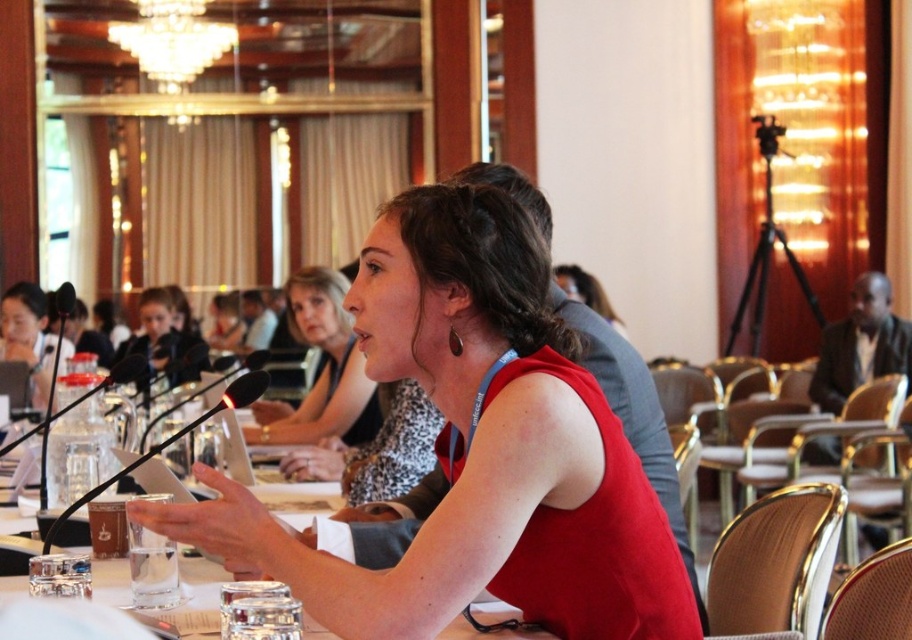
Question: Which object is the closest to the matte black microphone at upper left?

Choices:
 (A) matte red dress at center
 (B) red satin dress at center

Answer: (B)

Question: Which object is closer to the camera taking this photo?

Choices:
 (A) matte black microphone at upper left
 (B) red satin dress at center
 (C) matte red dress at center

Answer: (C)

Question: Does matte red dress at center have a larger size compared to matte black microphone at upper left?

Choices:
 (A) no
 (B) yes

Answer: (A)

Question: Does matte red dress at center appear over red satin dress at center?

Choices:
 (A) yes
 (B) no

Answer: (B)

Question: Among these points, which one is farthest from the camera?

Choices:
 (A) (444, 340)
 (B) (151, 291)
 (C) (308, 310)

Answer: (B)

Question: Can you confirm if matte red dress at center is positioned to the right of red satin dress at center?

Choices:
 (A) yes
 (B) no

Answer: (A)